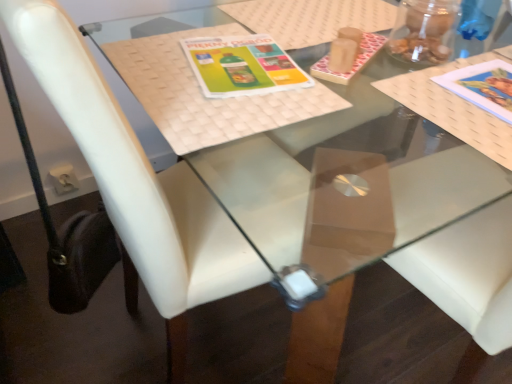
What do you see at coordinates (483, 86) in the screenshot? Image resolution: width=512 pixels, height=384 pixels. I see `matte paper book at upper right, which ranks as the 1th book cover in right-to-left order` at bounding box center [483, 86].

This screenshot has height=384, width=512. Identify the location of white leather chair at center. (137, 184).

The width and height of the screenshot is (512, 384). What do you see at coordinates (242, 66) in the screenshot? I see `matte green plastic book cover at center, placed as the 2th book cover when sorted from right to left` at bounding box center [242, 66].

The image size is (512, 384). What are the coordinates of `matte paper book at upper right, which appears as the 2th book cover when viewed from the left` in the screenshot? It's located at (483, 86).

From a real-world perspective, which book cover is the 2nd one above the white leather chair at center? Please provide its 2D coordinates.

[(483, 86)]

Looking at this image, is white leather chair at center inside matte paper book at upper right, which appears as the 2th book cover when viewed from the left?

No, white leather chair at center is not a part of matte paper book at upper right, which appears as the 2th book cover when viewed from the left.

Looking at the image, does matte paper book at upper right, which appears as the 2th book cover when viewed from the left, seem bigger or smaller compared to white leather chair at center?

In the image, matte paper book at upper right, which appears as the 2th book cover when viewed from the left, appears to be smaller than white leather chair at center.

Is matte paper book at upper right, which appears as the 2th book cover when viewed from the left, beside white leather chair at center?

No.

Considering the relative sizes of matte paper book at upper right, which appears as the 2th book cover when viewed from the left, and matte green plastic book cover at center, placed as the 2th book cover when sorted from right to left, in the image provided, is matte paper book at upper right, which appears as the 2th book cover when viewed from the left, wider than matte green plastic book cover at center, placed as the 2th book cover when sorted from right to left,?

Yes, matte paper book at upper right, which appears as the 2th book cover when viewed from the left, is wider than matte green plastic book cover at center, placed as the 2th book cover when sorted from right to left.

Between point (484, 80) and point (266, 48), which one is positioned behind?

The point (266, 48) is farther.

Is matte paper book at upper right, which ranks as the 1th book cover in right-to-left order, looking in the opposite direction of matte green plastic book cover at center, placed as the 2th book cover when sorted from right to left?

No, matte green plastic book cover at center, placed as the 2th book cover when sorted from right to left, is not at the back of matte paper book at upper right, which ranks as the 1th book cover in right-to-left order.

Is point (73, 45) positioned after point (225, 43)?

That is False.

Is white leather chair at center looking in the opposite direction of matte green plastic book cover at center, the first book cover viewed from the left?

That's right, white leather chair at center is facing away from matte green plastic book cover at center, the first book cover viewed from the left.

Is white leather chair at center at the right side of matte green plastic book cover at center, the first book cover viewed from the left?

In fact, white leather chair at center is to the left of matte green plastic book cover at center, the first book cover viewed from the left.

Which object is more forward, white leather chair at center or matte green plastic book cover at center, the first book cover viewed from the left?

Positioned in front is white leather chair at center.

Is matte green plastic book cover at center, the first book cover viewed from the left, next to matte paper book at upper right, which appears as the 2th book cover when viewed from the left, and touching it?

No, matte green plastic book cover at center, the first book cover viewed from the left, is not with matte paper book at upper right, which appears as the 2th book cover when viewed from the left.

Considering the relative positions of matte green plastic book cover at center, the first book cover viewed from the left, and matte paper book at upper right, which appears as the 2th book cover when viewed from the left, in the image provided, is matte green plastic book cover at center, the first book cover viewed from the left, to the left or to the right of matte paper book at upper right, which appears as the 2th book cover when viewed from the left,?

In the image, matte green plastic book cover at center, the first book cover viewed from the left, appears on the left side of matte paper book at upper right, which appears as the 2th book cover when viewed from the left.

This screenshot has height=384, width=512. What are the coordinates of `book cover behind the matte paper book at upper right, which appears as the 2th book cover when viewed from the left` in the screenshot? It's located at (242, 66).

From the image's perspective, is matte green plastic book cover at center, the first book cover viewed from the left, beneath matte paper book at upper right, which appears as the 2th book cover when viewed from the left?

Actually, matte green plastic book cover at center, the first book cover viewed from the left, appears above matte paper book at upper right, which appears as the 2th book cover when viewed from the left, in the image.

Would you say white leather chair at center is to the left or to the right of matte paper book at upper right, which appears as the 2th book cover when viewed from the left, in the picture?

white leather chair at center is to the left of matte paper book at upper right, which appears as the 2th book cover when viewed from the left.

Is white leather chair at center aimed at matte paper book at upper right, which appears as the 2th book cover when viewed from the left?

No.

From the image's perspective, does white leather chair at center appear higher than matte paper book at upper right, which appears as the 2th book cover when viewed from the left?

No, from the image's perspective, white leather chair at center is not above matte paper book at upper right, which appears as the 2th book cover when viewed from the left.

Could you measure the distance between white leather chair at center and matte paper book at upper right, which ranks as the 1th book cover in right-to-left order?

24.63 inches.

Is matte green plastic book cover at center, placed as the 2th book cover when sorted from right to left, not within white leather chair at center?

No, matte green plastic book cover at center, placed as the 2th book cover when sorted from right to left, is not entirely external to white leather chair at center.

How much distance is there between matte green plastic book cover at center, placed as the 2th book cover when sorted from right to left, and white leather chair at center?

matte green plastic book cover at center, placed as the 2th book cover when sorted from right to left, and white leather chair at center are 12.56 inches apart.

From the image's perspective, which one is positioned lower, matte green plastic book cover at center, placed as the 2th book cover when sorted from right to left, or white leather chair at center?

white leather chair at center, from the image's perspective.

Is the surface of matte green plastic book cover at center, placed as the 2th book cover when sorted from right to left, in direct contact with white leather chair at center?

No, matte green plastic book cover at center, placed as the 2th book cover when sorted from right to left, is not touching white leather chair at center.

Find the location of a particular element. the 2nd book cover to the right of the white leather chair at center, counting from the anchor's position is located at coordinates (483, 86).

Identify the location of book cover behind the matte paper book at upper right, which ranks as the 1th book cover in right-to-left order. (242, 66).

From the image, which object appears to be nearer to matte paper book at upper right, which ranks as the 1th book cover in right-to-left order, matte green plastic book cover at center, the first book cover viewed from the left, or white leather chair at center?

matte green plastic book cover at center, the first book cover viewed from the left.

When comparing their distances from matte green plastic book cover at center, the first book cover viewed from the left, does white leather chair at center or matte paper book at upper right, which appears as the 2th book cover when viewed from the left, seem further?

matte paper book at upper right, which appears as the 2th book cover when viewed from the left, is positioned further to the anchor matte green plastic book cover at center, the first book cover viewed from the left.

Estimate the real-world distances between objects in this image. Which object is further from matte green plastic book cover at center, placed as the 2th book cover when sorted from right to left, matte paper book at upper right, which ranks as the 1th book cover in right-to-left order, or white leather chair at center?

matte paper book at upper right, which ranks as the 1th book cover in right-to-left order, is further to matte green plastic book cover at center, placed as the 2th book cover when sorted from right to left.

Looking at the image, which one is located further to matte paper book at upper right, which appears as the 2th book cover when viewed from the left, white leather chair at center or matte green plastic book cover at center, placed as the 2th book cover when sorted from right to left?

The object further to matte paper book at upper right, which appears as the 2th book cover when viewed from the left, is white leather chair at center.

From the image, which object appears to be nearer to white leather chair at center, matte green plastic book cover at center, the first book cover viewed from the left, or matte paper book at upper right, which ranks as the 1th book cover in right-to-left order?

Based on the image, matte green plastic book cover at center, the first book cover viewed from the left, appears to be nearer to white leather chair at center.

Considering their positions, is matte paper book at upper right, which appears as the 2th book cover when viewed from the left, positioned further to white leather chair at center than matte green plastic book cover at center, placed as the 2th book cover when sorted from right to left?

Based on the image, matte paper book at upper right, which appears as the 2th book cover when viewed from the left, appears to be further to white leather chair at center.

Where is `book cover between white leather chair at center and matte paper book at upper right, which appears as the 2th book cover when viewed from the left, from left to right`? The image size is (512, 384). book cover between white leather chair at center and matte paper book at upper right, which appears as the 2th book cover when viewed from the left, from left to right is located at coordinates (242, 66).